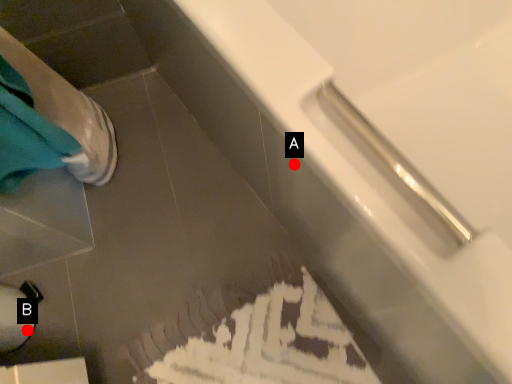
Question: Two points are circled on the image, labeled by A and B beside each circle. Which point appears closest to the camera in this image?

Choices:
 (A) A is closer
 (B) B is closer

Answer: (A)